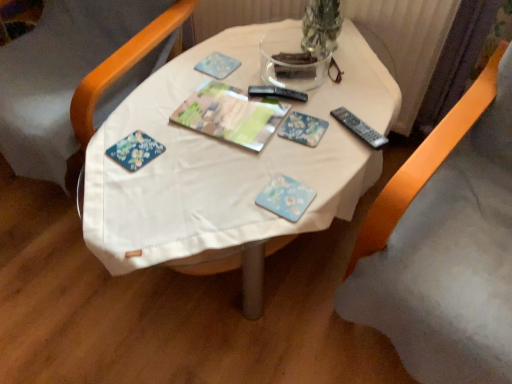
In order to click on free space behind floral paper magazine at center in this screenshot , I will do (232, 70).